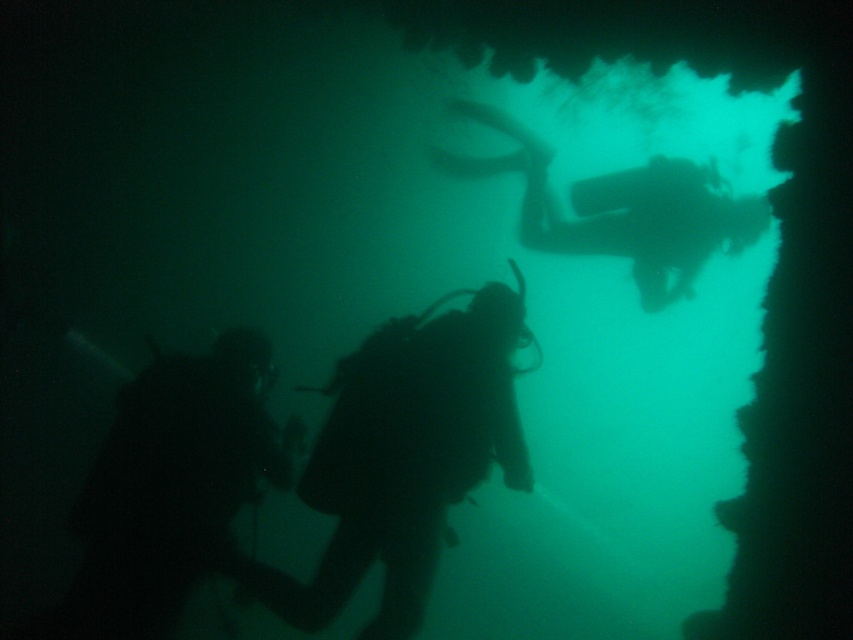
Is black matte scuba diver at center bigger than black matte scuba diver at lower left?

Indeed, black matte scuba diver at center has a larger size compared to black matte scuba diver at lower left.

Is the position of black matte scuba diver at center more distant than that of black matte scuba diver at lower left?

That is False.

Between point (340, 552) and point (109, 608), which one is positioned behind?

The point (109, 608) is more distant.

The width and height of the screenshot is (853, 640). Find the location of `black matte scuba diver at center`. black matte scuba diver at center is located at coordinates (405, 458).